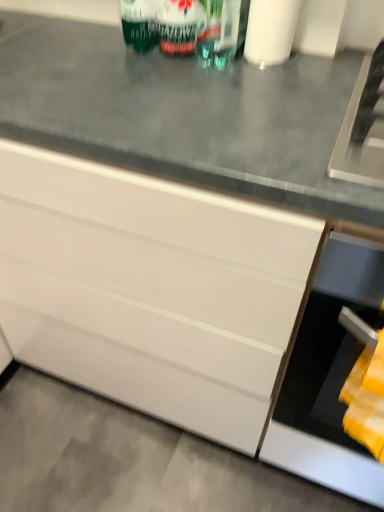
Question: Is green glass wine bottle at upper center at the back of green matte can at upper center?

Choices:
 (A) yes
 (B) no

Answer: (B)

Question: Is green matte can at upper center next to green glass wine bottle at upper center and touching it?

Choices:
 (A) yes
 (B) no

Answer: (A)

Question: Would you consider green matte can at upper center to be distant from green glass wine bottle at upper center?

Choices:
 (A) yes
 (B) no

Answer: (B)

Question: Does green matte can at upper center have a greater height compared to green glass wine bottle at upper center?

Choices:
 (A) yes
 (B) no

Answer: (B)

Question: From the image's perspective, is green matte can at upper center on top of green glass wine bottle at upper center?

Choices:
 (A) no
 (B) yes

Answer: (A)

Question: Is green matte can at upper center shorter than green glass wine bottle at upper center?

Choices:
 (A) yes
 (B) no

Answer: (A)

Question: Can you confirm if white matte toilet paper at upper center is thinner than yellow fabric at lower right?

Choices:
 (A) yes
 (B) no

Answer: (B)

Question: Is white matte toilet paper at upper center oriented towards yellow fabric at lower right?

Choices:
 (A) no
 (B) yes

Answer: (A)

Question: Would you say yellow fabric at lower right is part of white matte toilet paper at upper center's contents?

Choices:
 (A) yes
 (B) no

Answer: (B)

Question: Can you confirm if white matte toilet paper at upper center is smaller than yellow fabric at lower right?

Choices:
 (A) no
 (B) yes

Answer: (B)

Question: Considering the relative sizes of white matte toilet paper at upper center and yellow fabric at lower right in the image provided, is white matte toilet paper at upper center bigger than yellow fabric at lower right?

Choices:
 (A) yes
 (B) no

Answer: (B)

Question: From the image's perspective, is white matte toilet paper at upper center below yellow fabric at lower right?

Choices:
 (A) no
 (B) yes

Answer: (A)

Question: From the image's perspective, is white glossy cabinet at center on black matte oven at lower right?

Choices:
 (A) yes
 (B) no

Answer: (A)